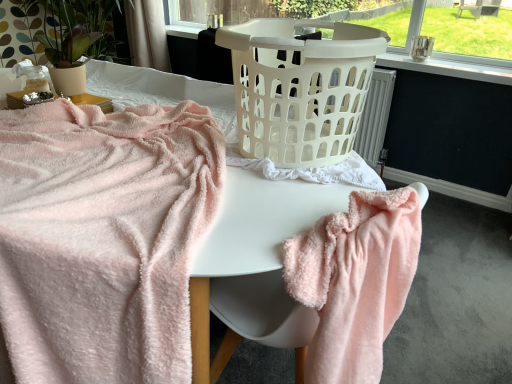
Question: Does white sheer curtain at upper center have a greater height compared to fluffy pink towel at lower right, which appears as the 1th towel when viewed from the right?

Choices:
 (A) no
 (B) yes

Answer: (A)

Question: Considering the relative positions of white sheer curtain at upper center and fluffy pink towel at lower right, which appears as the 1th towel when viewed from the right, in the image provided, is white sheer curtain at upper center to the right of fluffy pink towel at lower right, which appears as the 1th towel when viewed from the right, from the viewer's perspective?

Choices:
 (A) yes
 (B) no

Answer: (B)

Question: Is there a large distance between white sheer curtain at upper center and fluffy pink towel at lower right, which appears as the 1th towel when viewed from the right?

Choices:
 (A) yes
 (B) no

Answer: (A)

Question: From the image's perspective, is white sheer curtain at upper center beneath fluffy pink towel at lower right, which appears as the 1th towel when viewed from the right?

Choices:
 (A) yes
 (B) no

Answer: (B)

Question: From a real-world perspective, is white sheer curtain at upper center positioned over fluffy pink towel at lower right, which appears as the 1th towel when viewed from the right, based on gravity?

Choices:
 (A) no
 (B) yes

Answer: (B)

Question: Is white sheer curtain at upper center oriented towards fluffy pink towel at lower right, which appears as the 1th towel when viewed from the right?

Choices:
 (A) no
 (B) yes

Answer: (A)

Question: Is matte beige pot at upper left in front of fluffy pink towel at lower right, placed as the second towel when sorted from left to right?

Choices:
 (A) yes
 (B) no

Answer: (B)

Question: Is matte beige pot at upper left shorter than fluffy pink towel at lower right, which appears as the 1th towel when viewed from the right?

Choices:
 (A) yes
 (B) no

Answer: (A)

Question: Is matte beige pot at upper left oriented away from fluffy pink towel at lower right, placed as the second towel when sorted from left to right?

Choices:
 (A) yes
 (B) no

Answer: (B)

Question: Could you tell me if matte beige pot at upper left is facing fluffy pink towel at lower right, placed as the second towel when sorted from left to right?

Choices:
 (A) yes
 (B) no

Answer: (B)

Question: Considering the relative positions of matte beige pot at upper left and fluffy pink towel at lower right, placed as the second towel when sorted from left to right, in the image provided, is matte beige pot at upper left to the right of fluffy pink towel at lower right, placed as the second towel when sorted from left to right, from the viewer's perspective?

Choices:
 (A) yes
 (B) no

Answer: (B)

Question: From the image's perspective, is matte beige pot at upper left above fluffy pink towel at lower right, placed as the second towel when sorted from left to right?

Choices:
 (A) no
 (B) yes

Answer: (B)

Question: From the image's perspective, is soft pink plush towel at left, acting as the 1th towel starting from the left, below white plastic laundry basket at center?

Choices:
 (A) no
 (B) yes

Answer: (B)